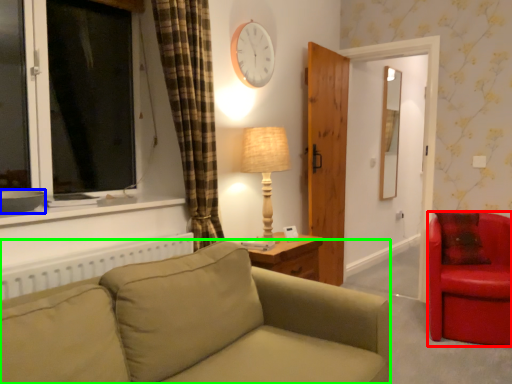
Question: Which object is the closest to the chair (highlighted by a red box)? Choose among these: bowl (highlighted by a blue box) or studio couch (highlighted by a green box).

Choices:
 (A) bowl
 (B) studio couch

Answer: (B)